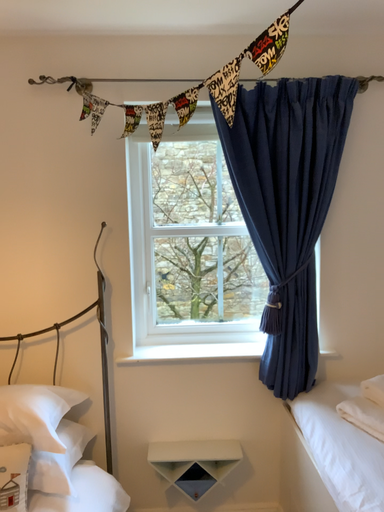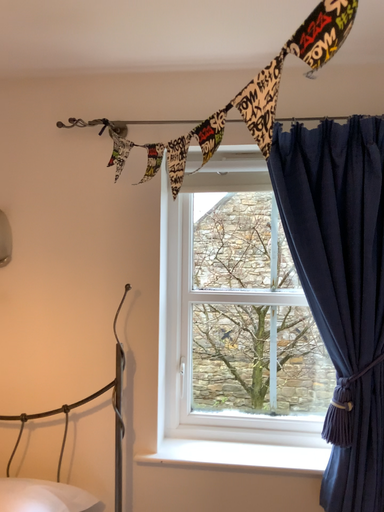
Question: Which way did the camera rotate in the video?

Choices:
 (A) rotated right
 (B) rotated left

Answer: (B)